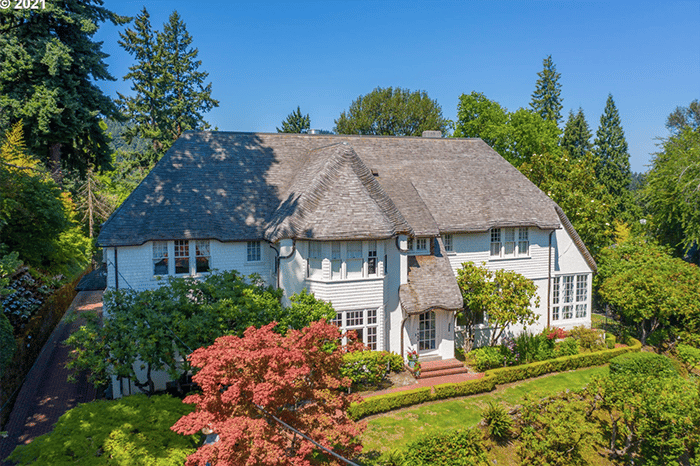
You are a GUI agent. You are given a task and a screenshot of the screen. Output one action in this format:
    pyautogui.click(x=<x>, y=<y>)
    Task: Click on the door
    The height and width of the screenshot is (466, 700).
    Given the screenshot: What is the action you would take?
    pyautogui.click(x=425, y=340)